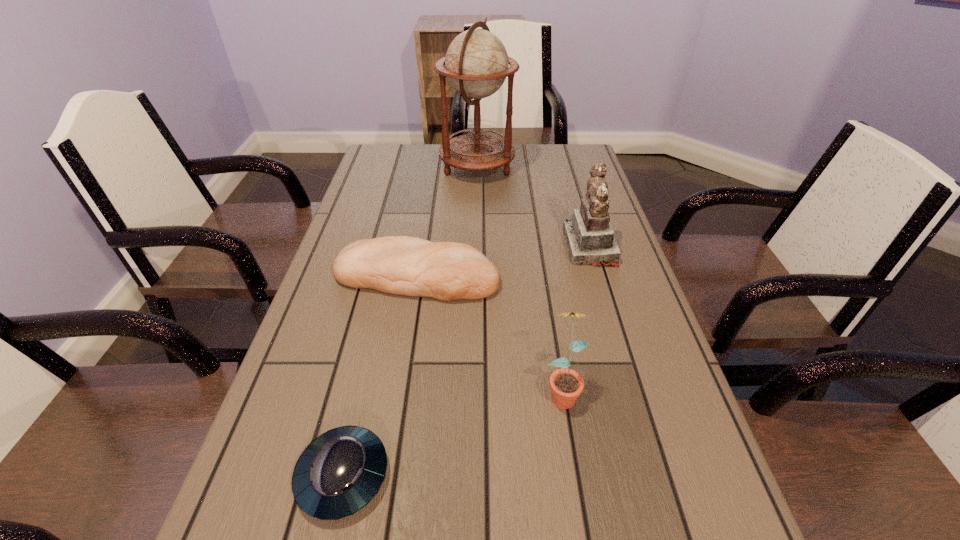
I want to click on empty space that is in between the sunflower and the nearest object, so click(x=452, y=433).

Where is `vacant point located between the rightmost object and the second shortest object`? Image resolution: width=960 pixels, height=540 pixels. vacant point located between the rightmost object and the second shortest object is located at coordinates (503, 261).

Find the location of a particular element. empty space that is in between the tallest object and the third tallest object is located at coordinates (519, 278).

Locate an element on the screen. Image resolution: width=960 pixels, height=540 pixels. object that is the second nearest to the globe is located at coordinates (401, 265).

Choose which object is the fourth nearest neighbor to the bread. Please provide its 2D coordinates. Your answer should be formatted as a tuple, i.e. [(x, y)], where the tuple contains the x and y coordinates of a point satisfying the conditions above.

[(476, 64)]

At what (x,y) coordinates should I click in order to perform the action: click on free location that satisfies the following two spatial constraints: 1. on the surface of the tallest object; 2. on the front side of the shortest object. Please return your answer as a coordinate pair (x, y). This screenshot has height=540, width=960. Looking at the image, I should click on (474, 475).

I want to click on free location that satisfies the following two spatial constraints: 1. on the front-facing side of the rightmost object; 2. on the flower of the fourth farthest object, so click(633, 390).